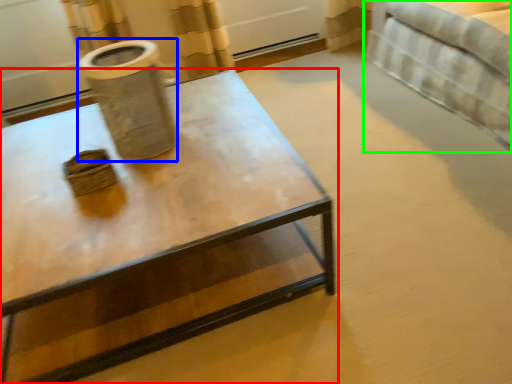
Question: Estimate the real-world distances between objects in this image. Which object is closer to coffee table (highlighted by a red box), vase (highlighted by a blue box) or bed (highlighted by a green box)?

Choices:
 (A) vase
 (B) bed

Answer: (A)